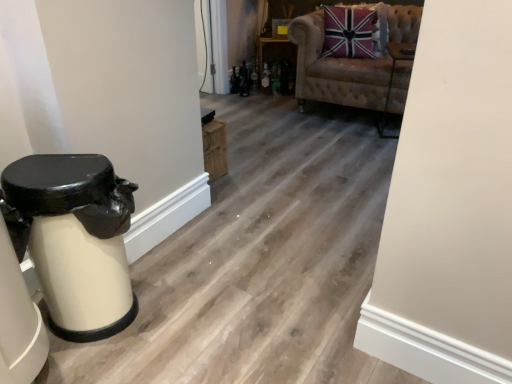
Question: Is white glossy trash can at left positioned in front of velvet union jack pillow at upper right?

Choices:
 (A) no
 (B) yes

Answer: (B)

Question: From a real-world perspective, is white glossy trash can at left positioned under velvet union jack pillow at upper right based on gravity?

Choices:
 (A) yes
 (B) no

Answer: (A)

Question: Is the surface of white glossy trash can at left in direct contact with velvet union jack pillow at upper right?

Choices:
 (A) no
 (B) yes

Answer: (A)

Question: Considering the relative positions of white glossy trash can at left and velvet union jack pillow at upper right in the image provided, is white glossy trash can at left to the right of velvet union jack pillow at upper right from the viewer's perspective?

Choices:
 (A) yes
 (B) no

Answer: (B)

Question: Could you tell me if white glossy trash can at left is turned towards velvet union jack pillow at upper right?

Choices:
 (A) yes
 (B) no

Answer: (B)

Question: From the image's perspective, is velvet union jack pillow at upper right positioned above or below white glossy trash can at left?

Choices:
 (A) above
 (B) below

Answer: (A)

Question: From a real-world perspective, is velvet union jack pillow at upper right positioned above or below white glossy trash can at left?

Choices:
 (A) below
 (B) above

Answer: (B)

Question: Considering the positions of point (330, 8) and point (61, 314), is point (330, 8) closer or farther from the camera than point (61, 314)?

Choices:
 (A) farther
 (B) closer

Answer: (A)

Question: Considering the positions of velvet union jack pillow at upper right and white glossy trash can at left in the image, is velvet union jack pillow at upper right bigger or smaller than white glossy trash can at left?

Choices:
 (A) small
 (B) big

Answer: (A)

Question: Looking at their shapes, would you say velvet beige armchair at upper center is wider or thinner than wooden shelf at center?

Choices:
 (A) thin
 (B) wide

Answer: (B)

Question: Is velvet beige armchair at upper center taller or shorter than wooden shelf at center?

Choices:
 (A) short
 (B) tall

Answer: (B)

Question: Considering the positions of velvet beige armchair at upper center and wooden shelf at center in the image, is velvet beige armchair at upper center bigger or smaller than wooden shelf at center?

Choices:
 (A) small
 (B) big

Answer: (B)

Question: Considering the positions of point (371, 82) and point (279, 71), is point (371, 82) closer or farther from the camera than point (279, 71)?

Choices:
 (A) closer
 (B) farther

Answer: (A)

Question: Considering the positions of wooden shelf at center and velvet union jack pillow at upper right in the image, is wooden shelf at center wider or thinner than velvet union jack pillow at upper right?

Choices:
 (A) wide
 (B) thin

Answer: (A)

Question: Is wooden shelf at center in front of or behind velvet union jack pillow at upper right in the image?

Choices:
 (A) front
 (B) behind

Answer: (B)